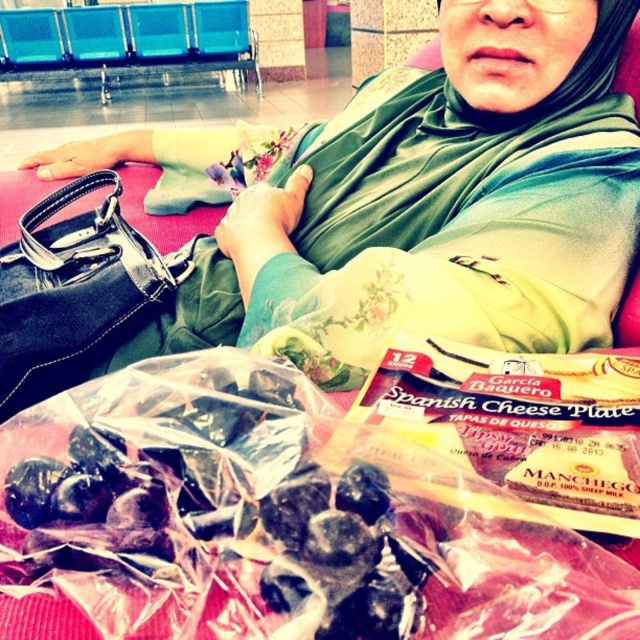
You are a customer service representative at the airport. A passenger asks if the green fabric scarf at upper center is to the left or right of the black leather handbag at left. Based on the scene, how would you respond?

The green fabric scarf at upper center is positioned on the right side of the black leather handbag at left, so it is to the right of the handbag.

You are a delivery robot with a 10 inch wide package. You need to navigate between the green fabric scarf at upper center and the black leather handbag at left to deliver the package. Can you fit through the space between them?

The green fabric scarf at upper center and black leather handbag at left are 9.12 inches apart from each other. Since the package is 10 inches wide, it is wider than the available space. Therefore, the delivery robot cannot fit through the space between them.